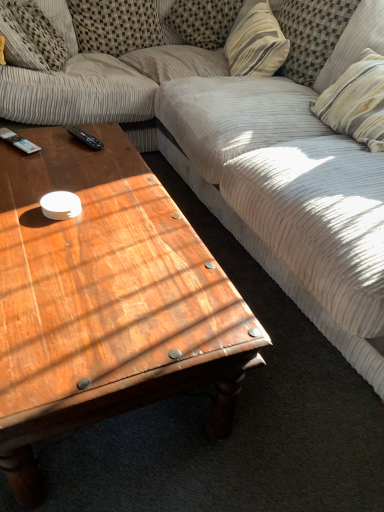
Find the location of a particular element. The width and height of the screenshot is (384, 512). unoccupied region to the right of black plastic remote control at upper left, acting as the 1th remote control starting from the left is located at coordinates (67, 151).